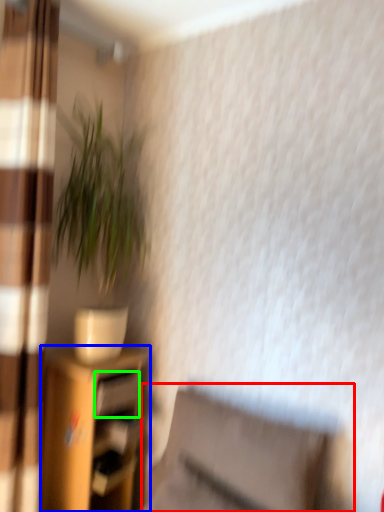
Question: Which object is the closest to the swivel chair (highlighted by a red box)? Choose among these: shelf (highlighted by a blue box) or drawer (highlighted by a green box).

Choices:
 (A) shelf
 (B) drawer

Answer: (A)